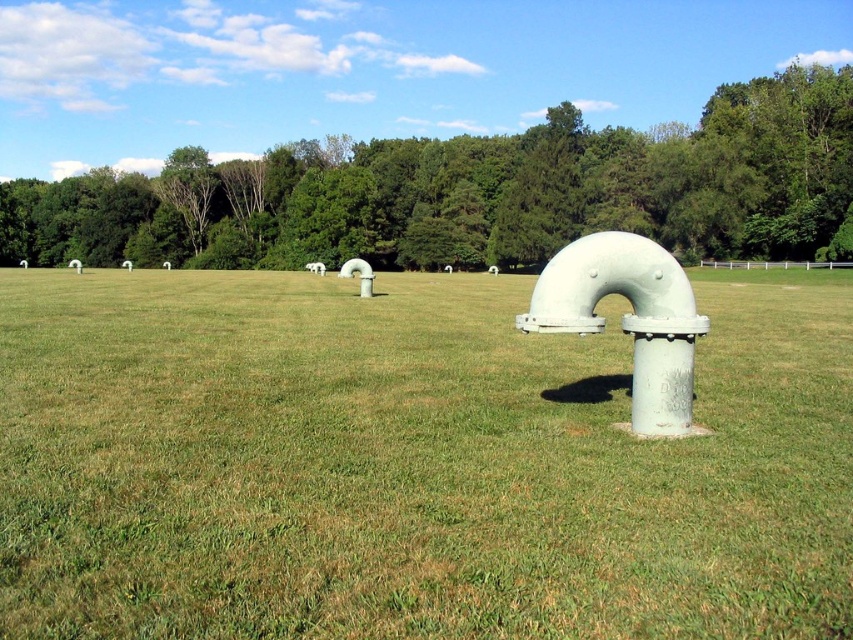
How far apart are green grassy at center and green leafy tree at center?

green grassy at center and green leafy tree at center are 123.20 feet apart from each other.

Can you confirm if green grassy at center is positioned to the right of green leafy tree at center?

Yes, green grassy at center is to the right of green leafy tree at center.

Between point (0, 406) and point (190, 154), which one is positioned in front?

Point (0, 406) is in front.

The image size is (853, 640). What are the coordinates of `green grassy at center` in the screenshot? It's located at (412, 461).